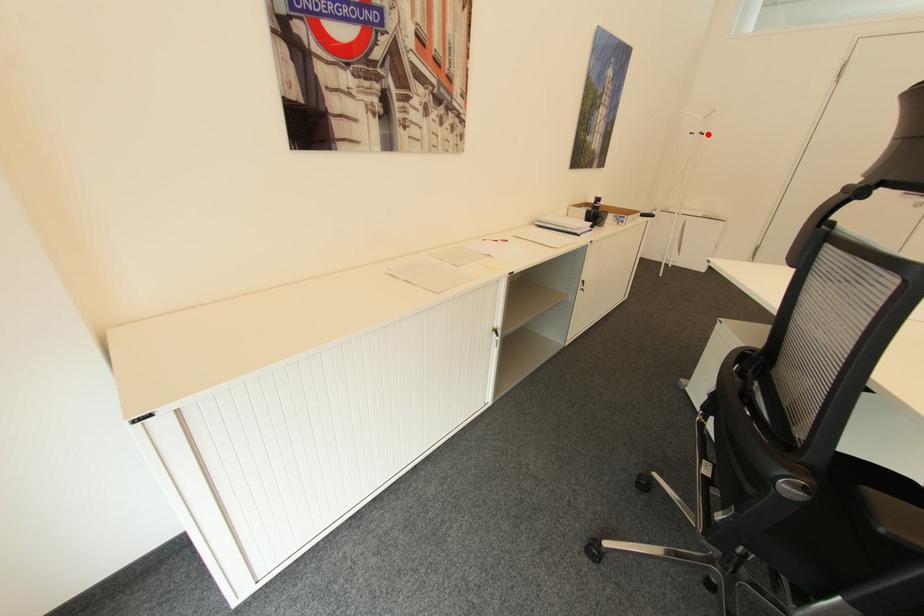
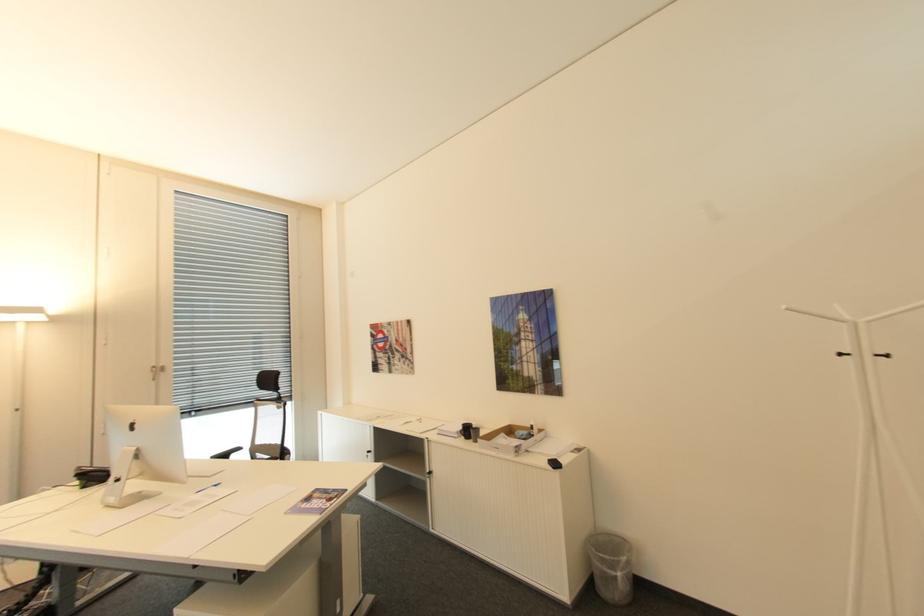
Where in the second image is the point corresponding to the highlighted location from the first image?

(894, 355)